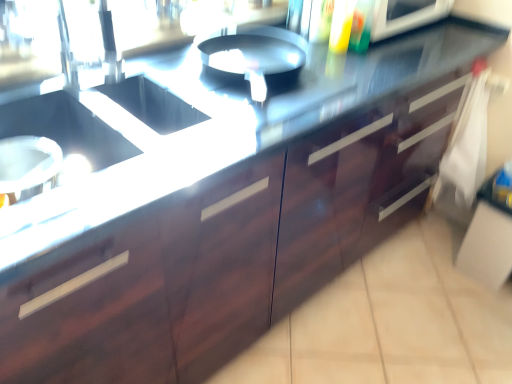
Question: Is translucent plastic bottle at upper center bigger than dark wood drawer at right?

Choices:
 (A) yes
 (B) no

Answer: (B)

Question: From a real-world perspective, does translucent plastic bottle at upper center sit lower than dark wood drawer at right?

Choices:
 (A) no
 (B) yes

Answer: (A)

Question: Could dark wood drawer at right be considered to be inside translucent plastic bottle at upper center?

Choices:
 (A) yes
 (B) no

Answer: (B)

Question: Can you confirm if translucent plastic bottle at upper center is positioned to the right of dark wood drawer at right?

Choices:
 (A) no
 (B) yes

Answer: (A)

Question: Is translucent plastic bottle at upper center completely or partially outside of dark wood drawer at right?

Choices:
 (A) yes
 (B) no

Answer: (A)

Question: Can you confirm if translucent plastic bottle at upper center is thinner than dark wood drawer at right?

Choices:
 (A) no
 (B) yes

Answer: (A)

Question: From a real-world perspective, is dark wood drawer at right under translucent plastic bottle at upper center?

Choices:
 (A) no
 (B) yes

Answer: (B)

Question: Can you confirm if dark wood drawer at right is thinner than translucent plastic bottle at upper center?

Choices:
 (A) yes
 (B) no

Answer: (A)

Question: Is dark wood drawer at right with translucent plastic bottle at upper center?

Choices:
 (A) yes
 (B) no

Answer: (B)

Question: Is dark wood drawer at right shorter than translucent plastic bottle at upper center?

Choices:
 (A) no
 (B) yes

Answer: (A)

Question: Does dark wood drawer at right have a greater width compared to translucent plastic bottle at upper center?

Choices:
 (A) no
 (B) yes

Answer: (A)

Question: Is dark wood drawer at right closer to camera compared to translucent plastic bottle at upper center?

Choices:
 (A) no
 (B) yes

Answer: (A)

Question: Considering the positions of dark wood drawer at right and translucent plastic bottle at upper center in the image, is dark wood drawer at right taller or shorter than translucent plastic bottle at upper center?

Choices:
 (A) tall
 (B) short

Answer: (A)